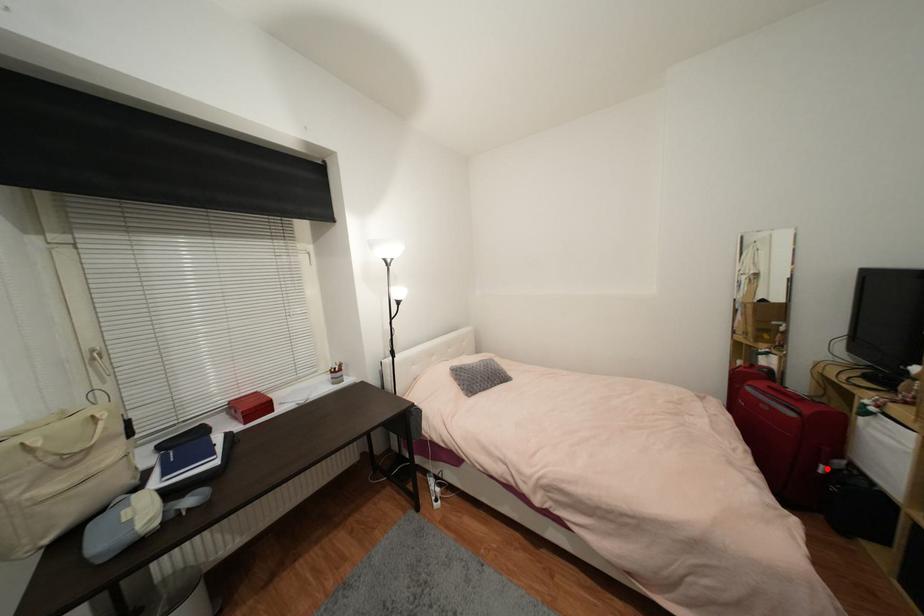
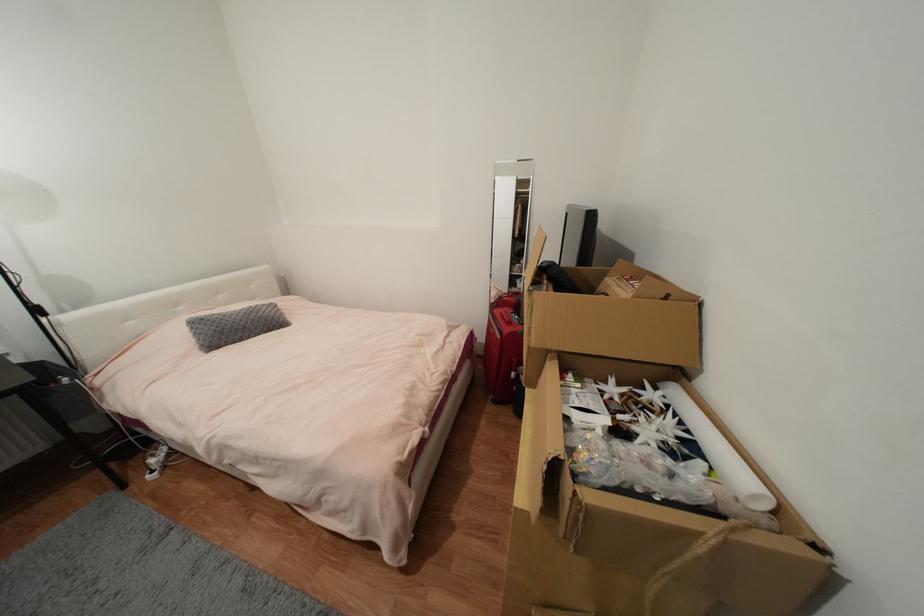
Question: A red point is marked in image1. In image2, is the corresponding 3D point closer to the camera or farther? Reply with the corresponding letter.

Choices:
 (A) The corresponding 3D point is closer.
 (B) The corresponding 3D point is farther.

Answer: (A)